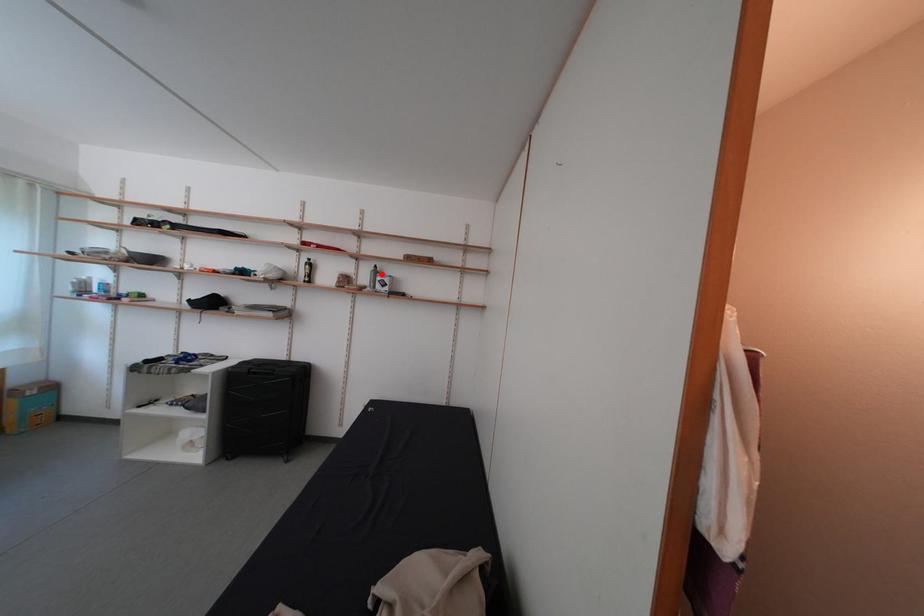
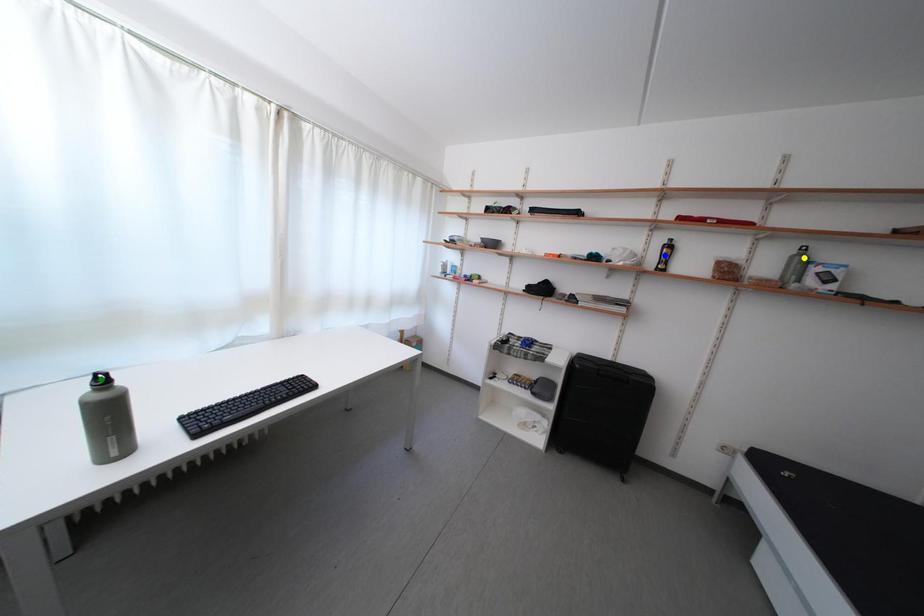
Question: I am providing you with two images of the same scene from different viewpoints. A red point is marked on the first image. You are given multiple points on the second image. Can you choose the point in image 2 that corresponds to the point in image 1?

Choices:
 (A) blue point
 (B) yellow point
 (C) green point

Answer: (B)